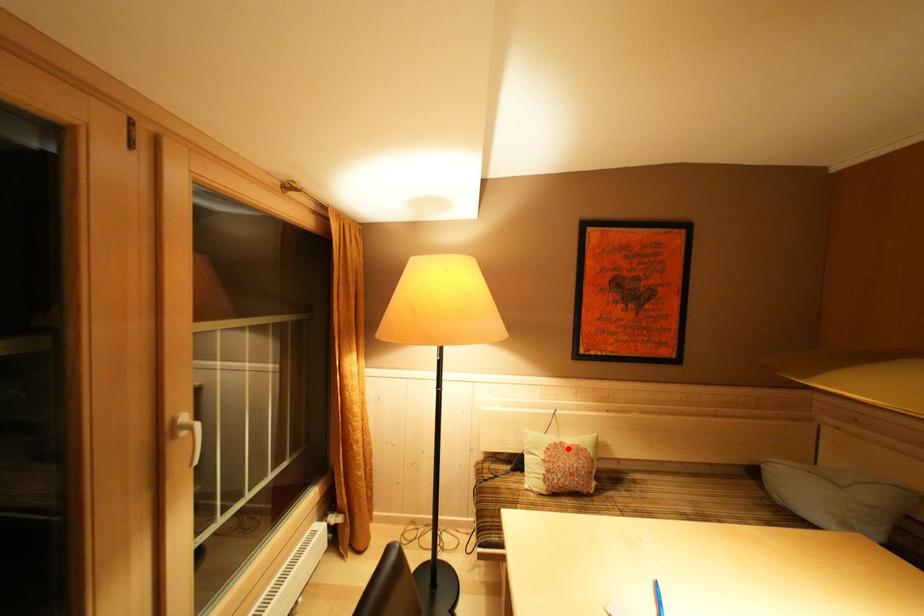
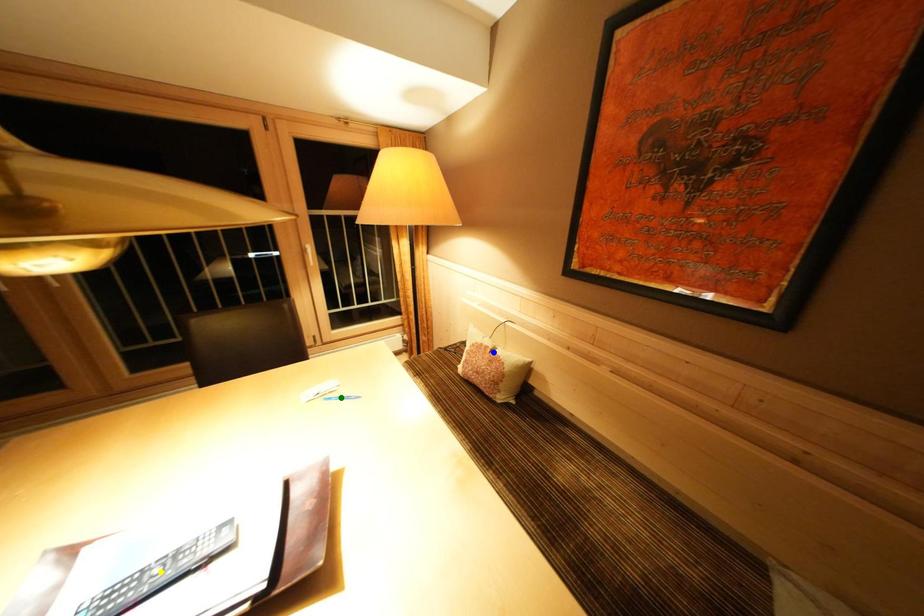
Question: I am providing you with two images of the same scene from different viewpoints. A red point is marked on the first image. You are given multiple points on the second image. Which spot in image 2 lines up with the point in image 1?

Choices:
 (A) green point
 (B) yellow point
 (C) blue point

Answer: (C)